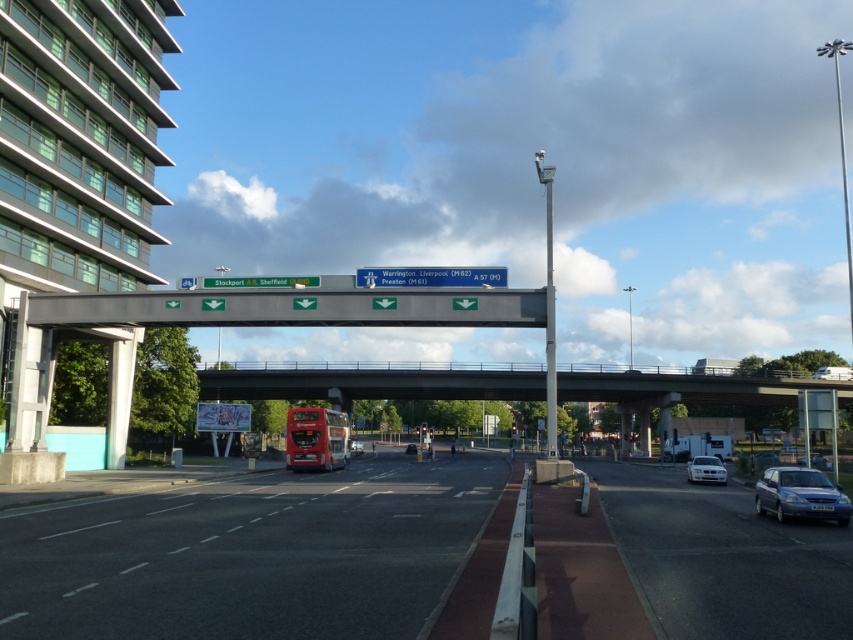
Which is more to the right, red matte double-decker bus at center or metallic green sign at upper center?

Positioned to the right is red matte double-decker bus at center.

Identify the location of red matte double-decker bus at center. The height and width of the screenshot is (640, 853). (315, 438).

Describe the element at coordinates (250, 554) in the screenshot. The image size is (853, 640). I see `black asphalt highway at center` at that location.

Looking at this image, which of these two, black asphalt highway at center or metallic green sign at upper center, stands shorter?

metallic green sign at upper center is shorter.

I want to click on black asphalt highway at center, so click(250, 554).

Locate an element on the screen. black asphalt highway at center is located at coordinates (250, 554).

Can you confirm if black asphalt highway at center is positioned above red matte double-decker bus at center?

Yes.

Consider the image. Does black asphalt highway at center have a greater width compared to red matte double-decker bus at center?

Yes, black asphalt highway at center is wider than red matte double-decker bus at center.

Which is behind, point (309, 608) or point (328, 426)?

Positioned behind is point (328, 426).

Identify the location of black asphalt highway at center. Image resolution: width=853 pixels, height=640 pixels. (250, 554).